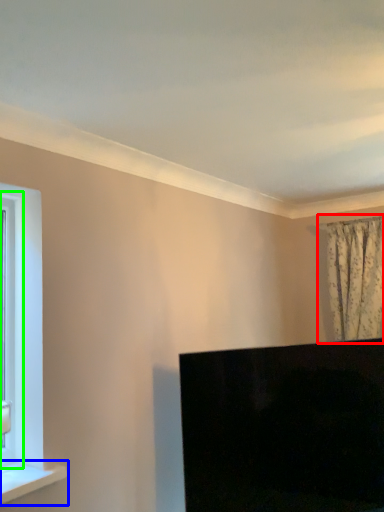
Question: Estimate the real-world distances between objects in this image. Which object is farther from curtain (highlighted by a red box), window sill (highlighted by a blue box) or window frame (highlighted by a green box)?

Choices:
 (A) window sill
 (B) window frame

Answer: (B)